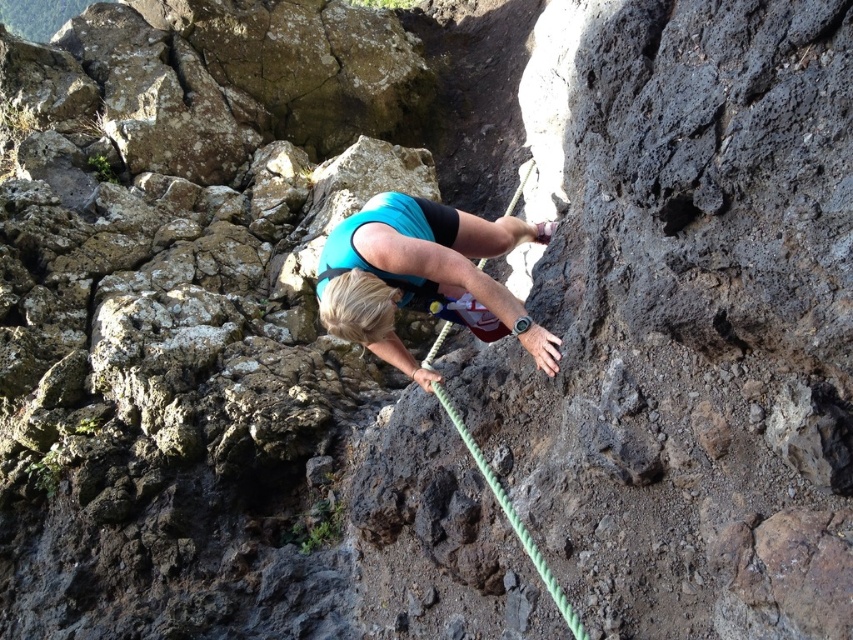
Question: Does blue fabric climber at center have a smaller size compared to green rope at center?

Choices:
 (A) no
 (B) yes

Answer: (A)

Question: Among these points, which one is farthest from the camera?

Choices:
 (A) (495, 484)
 (B) (424, 225)

Answer: (B)

Question: Is blue fabric climber at center below green rope at center?

Choices:
 (A) no
 (B) yes

Answer: (A)

Question: Which of the following is the farthest from the observer?

Choices:
 (A) green rope at center
 (B) blue fabric climber at center

Answer: (B)

Question: Does blue fabric climber at center appear on the left side of green rope at center?

Choices:
 (A) yes
 (B) no

Answer: (A)